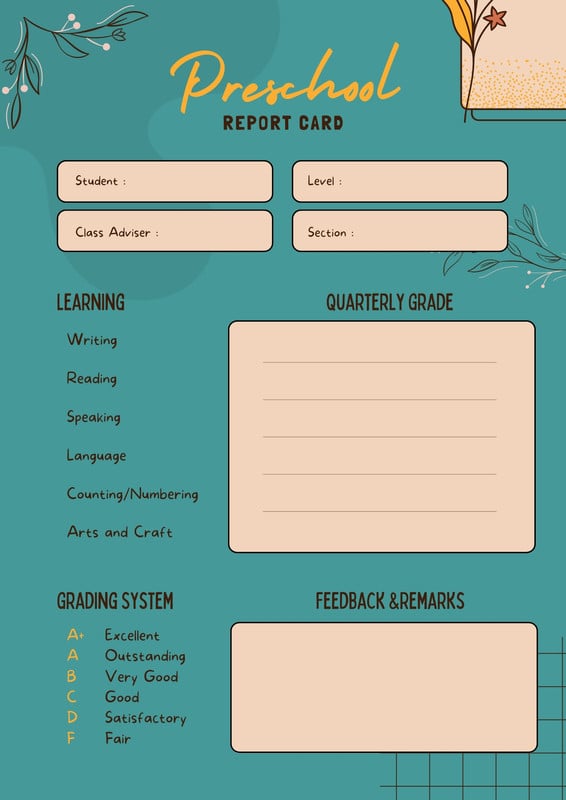
You are a GUI agent. You are given a task and a screenshot of the screen. Output one action in this format:
    pyautogui.click(x=<x>, y=<y>)
    Task: Click on the box
    Image resolution: width=566 pixels, height=800 pixels.
    Given the screenshot: What is the action you would take?
    pyautogui.click(x=380, y=677)